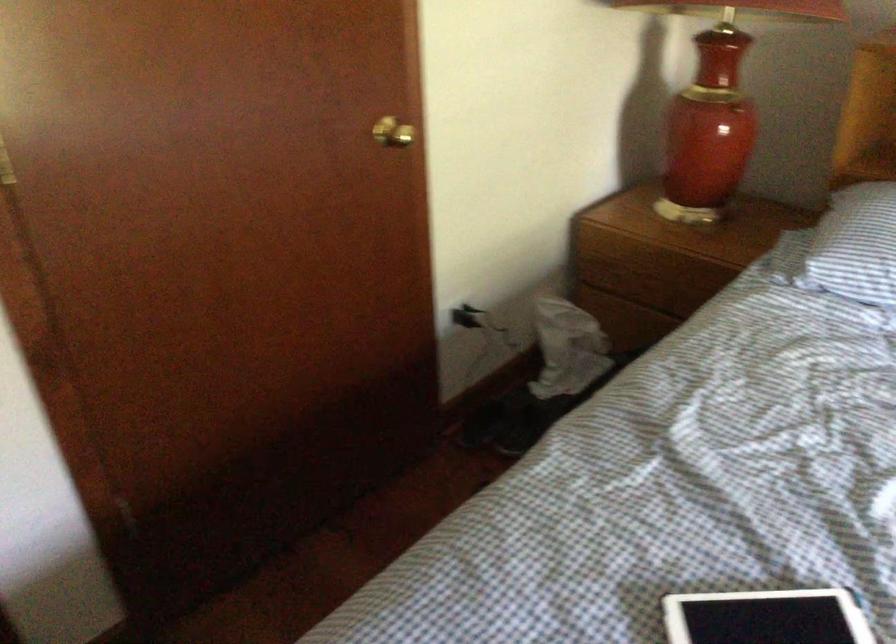
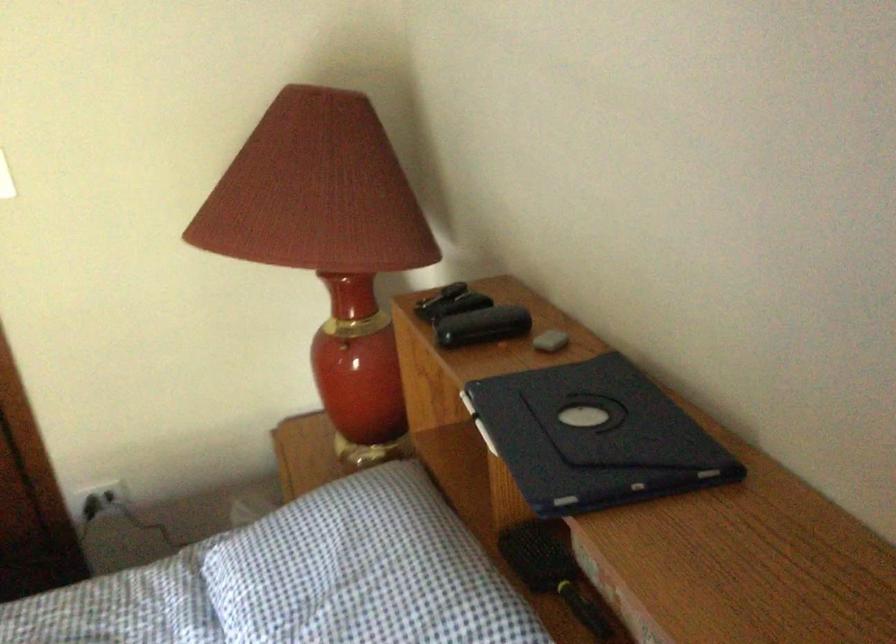
The point at [479,319] is marked in the first image. Where is the corresponding point in the second image?

(99, 500)